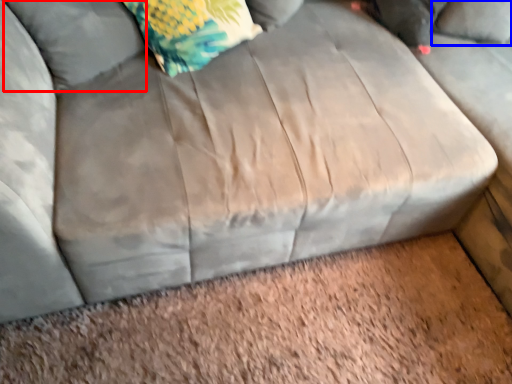
Question: Which point is closer to the camera, pillow (highlighted by a red box) or pillow (highlighted by a blue box)?

Choices:
 (A) pillow
 (B) pillow

Answer: (A)